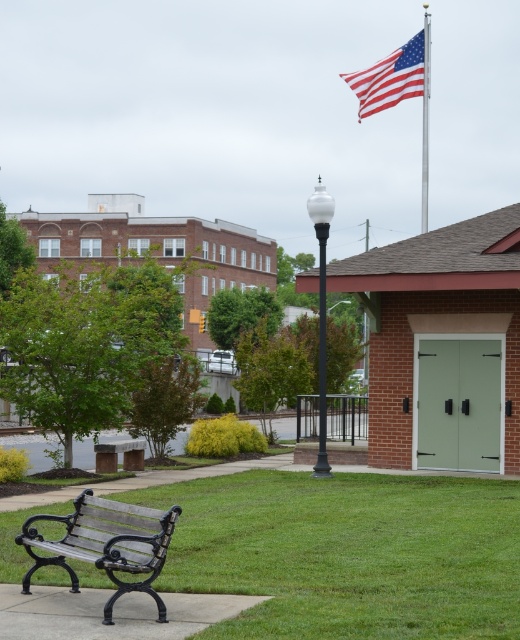
From the picture: Is black wrought iron bench at lower left further to camera compared to wooden bench at lower left?

No, it is not.

Which is more to the right, black wrought iron bench at lower left or wooden bench at lower left?

black wrought iron bench at lower left

Does point (135, 604) lie in front of point (145, 536)?

No, it is behind (145, 536).

The height and width of the screenshot is (640, 520). I want to click on black wrought iron bench at lower left, so click(112, 612).

The height and width of the screenshot is (640, 520). What do you see at coordinates (347, 554) in the screenshot?
I see `green grass at lower center` at bounding box center [347, 554].

This screenshot has width=520, height=640. I want to click on green grass at lower center, so click(x=347, y=554).

Does red/white/blue fabric flag at upper right appear on the left side of white glossy lamp post at center?

No, red/white/blue fabric flag at upper right is not to the left of white glossy lamp post at center.

Is point (381, 77) farther from camera compared to point (327, 198)?

Yes, point (381, 77) is farther from viewer.

The height and width of the screenshot is (640, 520). What are the coordinates of `red/white/blue fabric flag at upper right` in the screenshot? It's located at (394, 76).